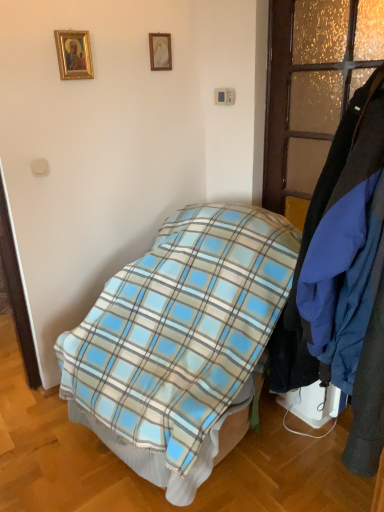
Question: From a real-world perspective, is gold-framed picture at upper left, which is the 2th picture frame in right-to-left order, located beneath blue fabric coat at right?

Choices:
 (A) no
 (B) yes

Answer: (A)

Question: Is gold-framed picture at upper left, arranged as the 1th picture frame when viewed from the front, smaller than blue fabric coat at right?

Choices:
 (A) no
 (B) yes

Answer: (B)

Question: Does gold-framed picture at upper left, arranged as the 1th picture frame when viewed from the front, have a lesser height compared to blue fabric coat at right?

Choices:
 (A) no
 (B) yes

Answer: (B)

Question: Considering the relative sizes of gold-framed picture at upper left, arranged as the 1th picture frame when viewed from the front, and blue fabric coat at right in the image provided, is gold-framed picture at upper left, arranged as the 1th picture frame when viewed from the front, thinner than blue fabric coat at right?

Choices:
 (A) yes
 (B) no

Answer: (A)

Question: From the image's perspective, is gold-framed picture at upper left, the 2th picture frame when ordered from back to front, on top of blue fabric coat at right?

Choices:
 (A) no
 (B) yes

Answer: (B)

Question: Considering the positions of blue plaid blanket at center and translucent frosted glass door at right in the image, is blue plaid blanket at center wider or thinner than translucent frosted glass door at right?

Choices:
 (A) wide
 (B) thin

Answer: (A)

Question: Choose the correct answer: Is blue plaid blanket at center inside translucent frosted glass door at right or outside it?

Choices:
 (A) inside
 (B) outside

Answer: (B)

Question: From the image's perspective, relative to translucent frosted glass door at right, is blue plaid blanket at center above or below?

Choices:
 (A) below
 (B) above

Answer: (A)

Question: Is blue plaid blanket at center bigger or smaller than translucent frosted glass door at right?

Choices:
 (A) small
 (B) big

Answer: (B)

Question: Considering the relative positions of matte gold picture frame at upper center, which is counted as the first picture frame, starting from the right, and gold-framed picture at upper left, arranged as the 1th picture frame when viewed from the front, in the image provided, is matte gold picture frame at upper center, which is counted as the first picture frame, starting from the right, to the left or to the right of gold-framed picture at upper left, arranged as the 1th picture frame when viewed from the front,?

Choices:
 (A) left
 (B) right

Answer: (B)

Question: Is matte gold picture frame at upper center, which is counted as the second picture frame, starting from the left, inside the boundaries of gold-framed picture at upper left, arranged as the 1th picture frame when viewed from the front, or outside?

Choices:
 (A) outside
 (B) inside

Answer: (A)

Question: In terms of size, does matte gold picture frame at upper center, which is counted as the second picture frame, starting from the left, appear bigger or smaller than gold-framed picture at upper left, which is the 2th picture frame in right-to-left order?

Choices:
 (A) small
 (B) big

Answer: (A)

Question: From a real-world perspective, is matte gold picture frame at upper center, which is counted as the first picture frame, starting from the right, physically located above or below gold-framed picture at upper left, arranged as the 1th picture frame when viewed from the front?

Choices:
 (A) above
 (B) below

Answer: (A)

Question: In terms of width, does translucent frosted glass door at right look wider or thinner when compared to matte gold picture frame at upper center, arranged as the 2th picture frame when viewed from the front?

Choices:
 (A) wide
 (B) thin

Answer: (A)

Question: In terms of size, does translucent frosted glass door at right appear bigger or smaller than matte gold picture frame at upper center, which is counted as the first picture frame, starting from the right?

Choices:
 (A) small
 (B) big

Answer: (B)